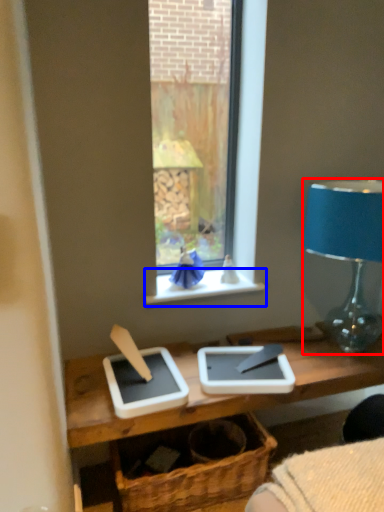
Question: Which point is further to the camera, lamp (highlighted by a red box) or window sill (highlighted by a blue box)?

Choices:
 (A) lamp
 (B) window sill

Answer: (B)